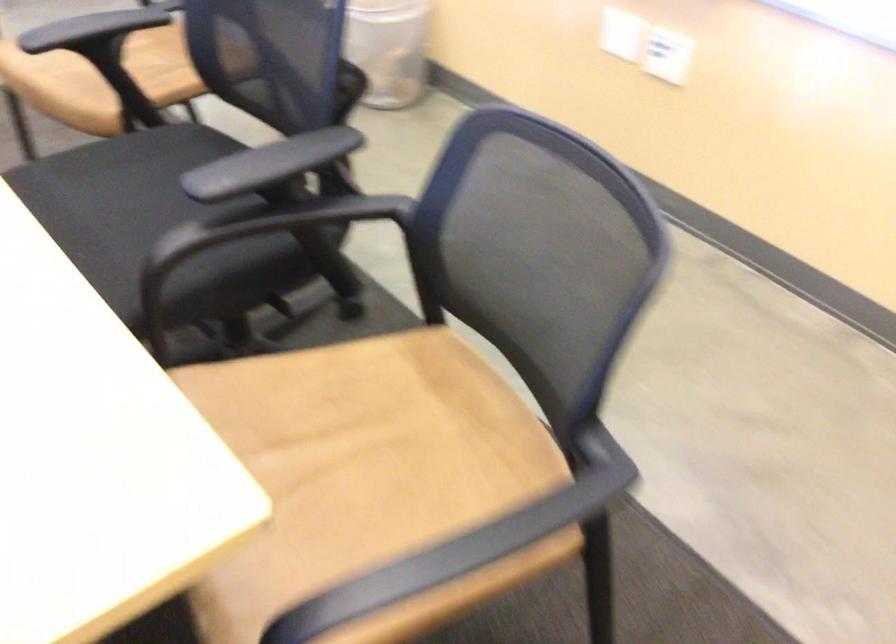
Find the location of a particular element. The height and width of the screenshot is (644, 896). black chair sitting surface is located at coordinates (347, 412).